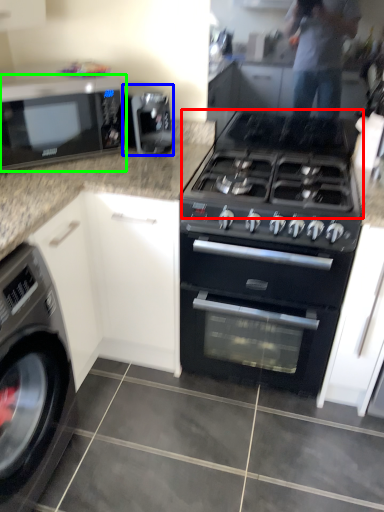
Question: Based on their relative distances, which object is farther from gas stove (highlighted by a red box)? Choose from appliance (highlighted by a blue box) and microwave oven (highlighted by a green box).

Choices:
 (A) appliance
 (B) microwave oven

Answer: (B)